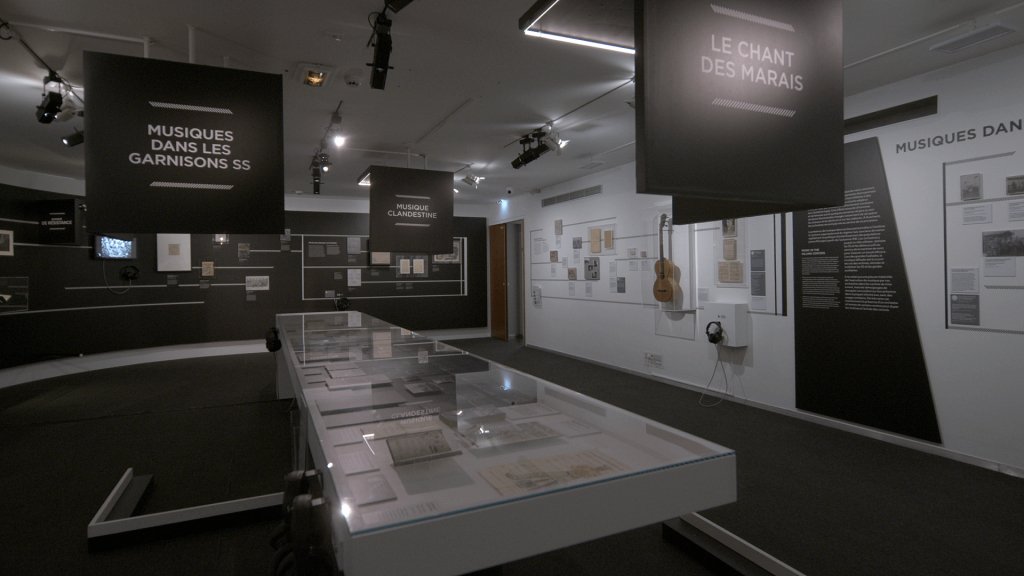
Where is `screen`? The width and height of the screenshot is (1024, 576). screen is located at coordinates (119, 244).